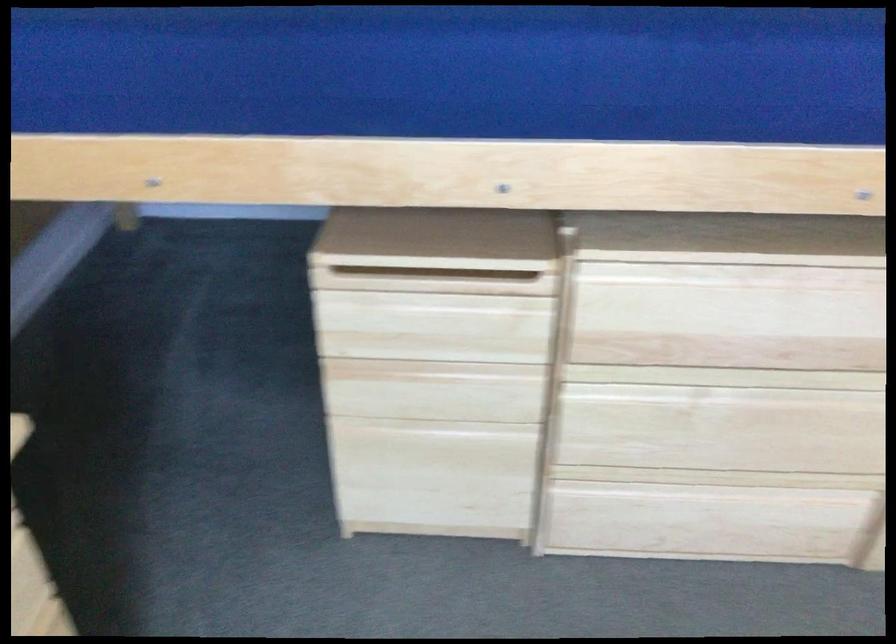
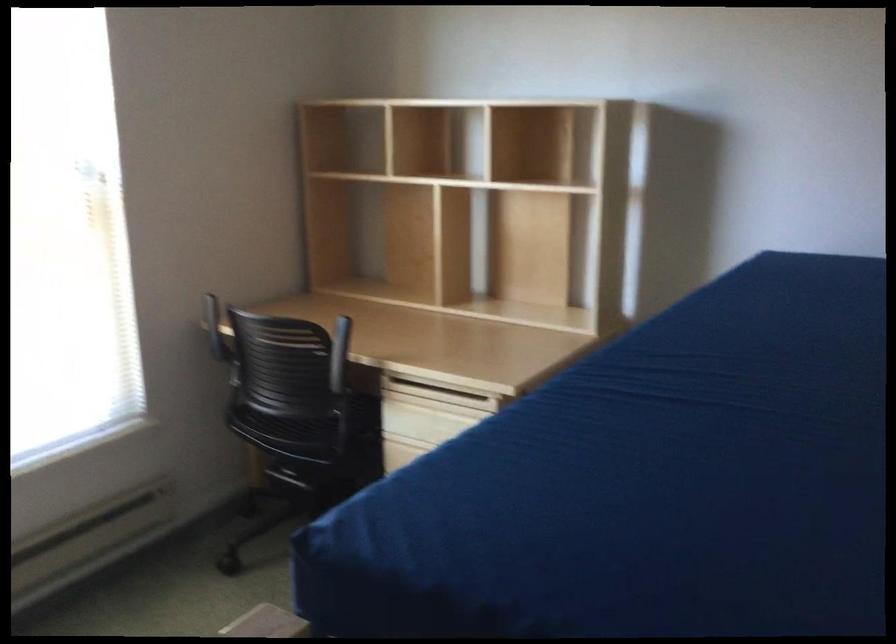
Question: I am providing you with two images of the same scene from different viewpoints. After the viewpoint changes to image2, which objects are now occluded?

Choices:
 (A) black microwave dial
 (B) black chair sitting surface
 (C) black chair armrest
 (D) wooden drawer handle

Answer: (D)